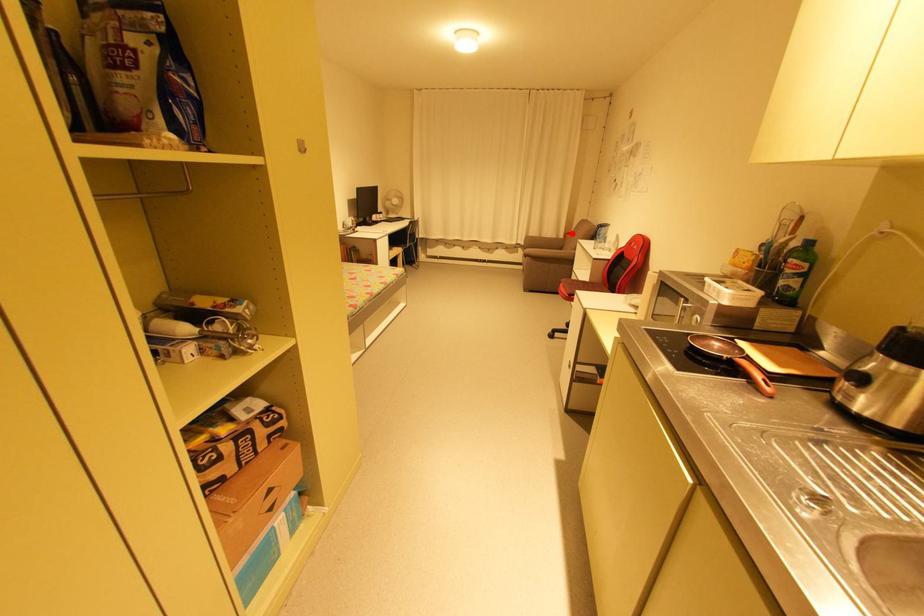
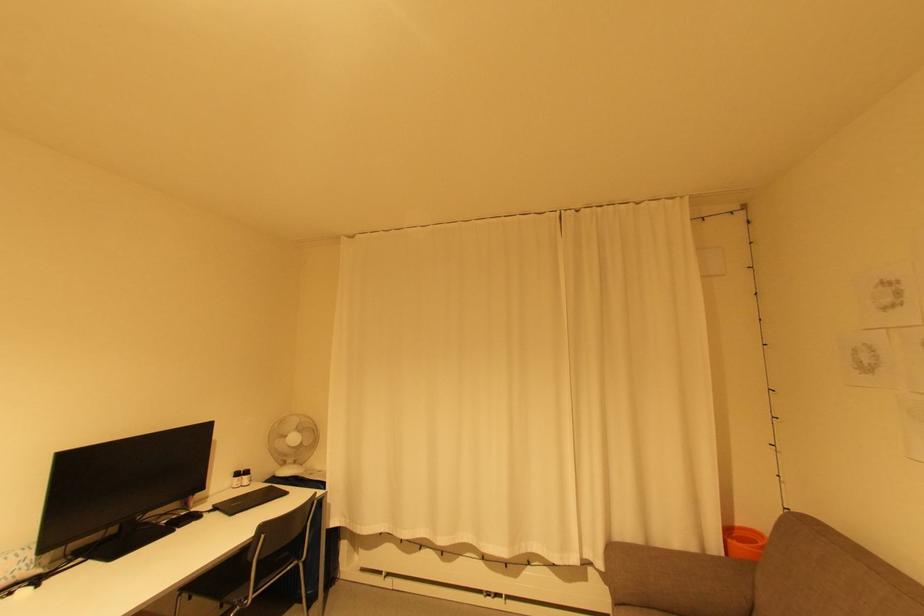
Question: I am providing you with two images of the same scene from different viewpoints. Given a red point in image1, look at the same physical point in image2. Is it:

Choices:
 (A) Closer to the viewpoint
 (B) Farther from the viewpoint

Answer: (B)